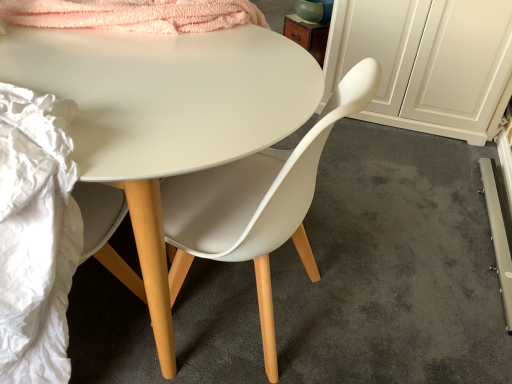
What do you see at coordinates (257, 204) in the screenshot?
I see `matte white chair at center` at bounding box center [257, 204].

In order to face matte white chair at center, should I rotate leftwards or rightwards?

A 8.333 degree turn to the right will do.

What do you see at coordinates (165, 115) in the screenshot? I see `white matte desk at center` at bounding box center [165, 115].

The width and height of the screenshot is (512, 384). Identify the location of white matte cabinet at right. (428, 62).

Is matte white chair at center aimed at matte white chair at center?

No, matte white chair at center does not turn towards matte white chair at center.

Between matte white chair at center and matte white chair at center, which one is positioned behind?

matte white chair at center is more distant.

Which of these two, matte white chair at center or matte white chair at center, is wider?

With larger width is matte white chair at center.

From a real-world perspective, is matte white chair at center below matte white chair at center?

Yes, from a real-world perspective, matte white chair at center is beneath matte white chair at center.

Can we say white matte cabinet at right lies outside matte white chair at center?

That's correct, white matte cabinet at right is outside of matte white chair at center.

Is white matte cabinet at right next to matte white chair at center?

They are not placed beside each other.

Is white matte cabinet at right behind matte white chair at center?

Yes, white matte cabinet at right is further from the viewer.

Based on their positions, is white matte cabinet at right located to the left or right of matte white chair at center?

white matte cabinet at right is positioned on matte white chair at center's right side.

Looking at this image, between white matte cabinet at right and matte white chair at center, which one has larger size?

white matte cabinet at right is bigger.

How different are the orientations of white matte cabinet at right and matte white chair at center in degrees?

There is a 91.1-degree angle between the facing directions of white matte cabinet at right and matte white chair at center.

Which point is more forward, (473, 68) or (221, 174)?

The point (221, 174) is closer.

Who is smaller, white matte cabinet at right or white matte desk at center?

Smaller between the two is white matte cabinet at right.

Which of these two, white matte cabinet at right or white matte desk at center, is wider?

With larger width is white matte desk at center.

Is white matte cabinet at right completely or partially outside of white matte desk at center?

Yes, white matte cabinet at right is not within white matte desk at center.

Considering the positions of objects white matte desk at center and matte white chair at center in the image provided, who is more to the left, white matte desk at center or matte white chair at center?

From the viewer's perspective, white matte desk at center appears more on the left side.

How different are the orientations of white matte desk at center and matte white chair at center in degrees?

There is a 180-degree angle between the facing directions of white matte desk at center and matte white chair at center.

Between white matte desk at center and matte white chair at center, which one is positioned behind?

matte white chair at center is further away from the camera.

Between matte white chair at center and matte white chair at center, which one has smaller size?

matte white chair at center is smaller.

Is matte white chair at center in contact with matte white chair at center?

matte white chair at center and matte white chair at center are not in contact.

Between matte white chair at center and matte white chair at center, which one appears on the left side from the viewer's perspective?

matte white chair at center is more to the left.

Is matte white chair at center wider than matte white chair at center?

No, matte white chair at center is not wider than matte white chair at center.

Are matte white chair at center and white matte desk at center located far from each other?

No, there isn't a large distance between matte white chair at center and white matte desk at center.

From the image's perspective, between matte white chair at center and white matte desk at center, who is located below?

matte white chair at center is shown below in the image.

Is white matte desk at center inside matte white chair at center?

No, white matte desk at center is not surrounded by matte white chair at center.

Can you confirm if matte white chair at center is bigger than white matte desk at center?

No.

At what (x,y) coordinates should I click in order to perform the action: click on chair below the matte white chair at center (from the image's perspective). Please return your answer as a coordinate pair (x, y). The image size is (512, 384). Looking at the image, I should click on (257, 204).

You are a GUI agent. You are given a task and a screenshot of the screen. Output one action in this format:
    pyautogui.click(x=<x>, y=<y>)
    Task: Click on the cabinetry above the matte white chair at center (from a real-world perspective)
    Image resolution: width=512 pixels, height=384 pixels.
    Given the screenshot: What is the action you would take?
    pyautogui.click(x=428, y=62)

From the image, which object appears to be farther from white matte cabinet at right, matte white chair at center or white matte desk at center?

white matte desk at center is positioned further to the anchor white matte cabinet at right.

Which object lies nearer to the anchor point white matte cabinet at right, matte white chair at center or matte white chair at center?

matte white chair at center is positioned closer to the anchor white matte cabinet at right.

Which object lies nearer to the anchor point matte white chair at center, white matte desk at center or white matte cabinet at right?

white matte desk at center is closer to matte white chair at center.

From the image, which object appears to be farther from matte white chair at center, white matte desk at center or matte white chair at center?

white matte desk at center lies further to matte white chair at center than the other object.

Which object lies nearer to the anchor point white matte cabinet at right, white matte desk at center or matte white chair at center?

The object closer to white matte cabinet at right is matte white chair at center.

Based on their spatial positions, is white matte desk at center or white matte cabinet at right further from matte white chair at center?

The object further to matte white chair at center is white matte cabinet at right.

Looking at the image, which one is located further to white matte desk at center, matte white chair at center or white matte cabinet at right?

The object further to white matte desk at center is white matte cabinet at right.

Based on their spatial positions, is white matte cabinet at right or matte white chair at center further from white matte desk at center?

white matte cabinet at right lies further to white matte desk at center than the other object.

In order to click on chair between white matte desk at center and white matte cabinet at right in the horizontal direction in this screenshot , I will do `click(257, 204)`.

Identify the location of concrete located between white matte desk at center and white matte cabinet at right in the left-right direction. (393, 267).

In order to click on concrete between matte white chair at center and white matte cabinet at right from front to back in this screenshot , I will do `click(393, 267)`.

The image size is (512, 384). I want to click on chair between white matte desk at center and matte white chair at center in the horizontal direction, so click(x=257, y=204).